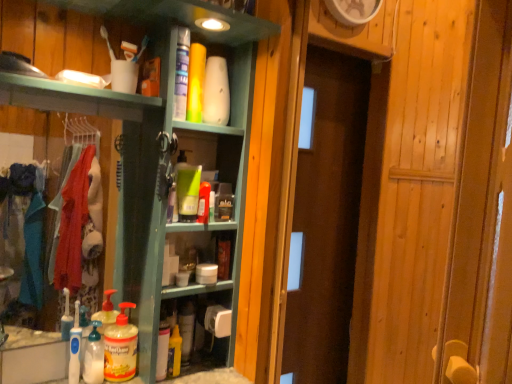
Question: In terms of width, does translucent plastic bottle at lower left, which ranks as the second cleaning product in left-to-right order, look wider or thinner when compared to yellow matte bottle at lower center, which ranks as the 6th cleaning product in left-to-right order?

Choices:
 (A) wide
 (B) thin

Answer: (A)

Question: From the image's perspective, is translucent plastic bottle at lower left, which ranks as the second cleaning product in left-to-right order, positioned above or below yellow matte bottle at lower center, the second cleaning product positioned from the right?

Choices:
 (A) below
 (B) above

Answer: (A)

Question: Estimate the real-world distances between objects in this image. Which object is farther from the translucent plastic spray bottle at lower center, the 4th cleaning product when ordered from left to right?

Choices:
 (A) translucent plastic soap dispenser at lower left, positioned as the 3th cleaning product in left-to-right order
 (B) yellow matte bottle at lower center, the second cleaning product positioned from the right
 (C) translucent plastic bottle at lower left, the first cleaning product viewed from the left
 (D) yellow matte bottle at lower center, placed as the 5th cleaning product when sorted from left to right
 (E) white fabric laundry at left

Answer: (E)

Question: Which of these objects is positioned farthest from the translucent plastic soap dispenser at lower left, which ranks as the fifth cleaning product in right-to-left order?

Choices:
 (A) white fabric laundry at left
 (B) translucent plastic bottle at lower left, which ranks as the second cleaning product in left-to-right order
 (C) wooden door at center
 (D) yellow matte bottle at lower center, which ranks as the 6th cleaning product in left-to-right order
 (E) green matte bottle at center, acting as the 1th cleaning product starting from the right

Answer: (C)